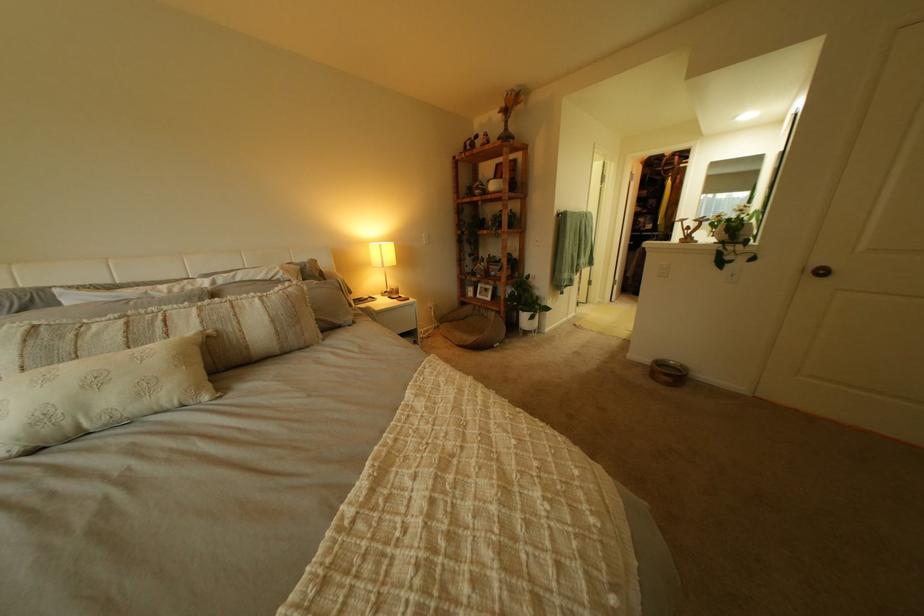
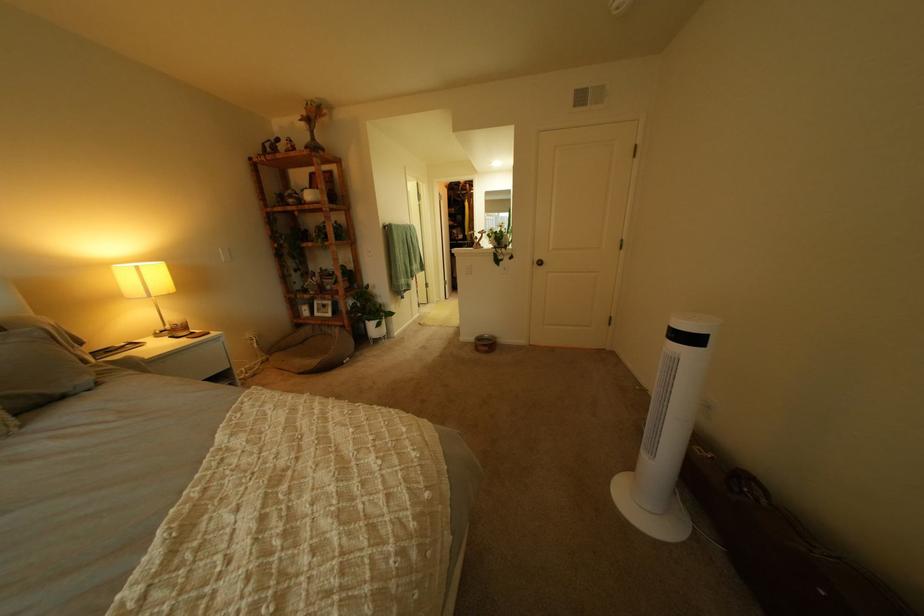
Where in the second image is the point corresponding to point 663,362 from the first image?

(489, 339)